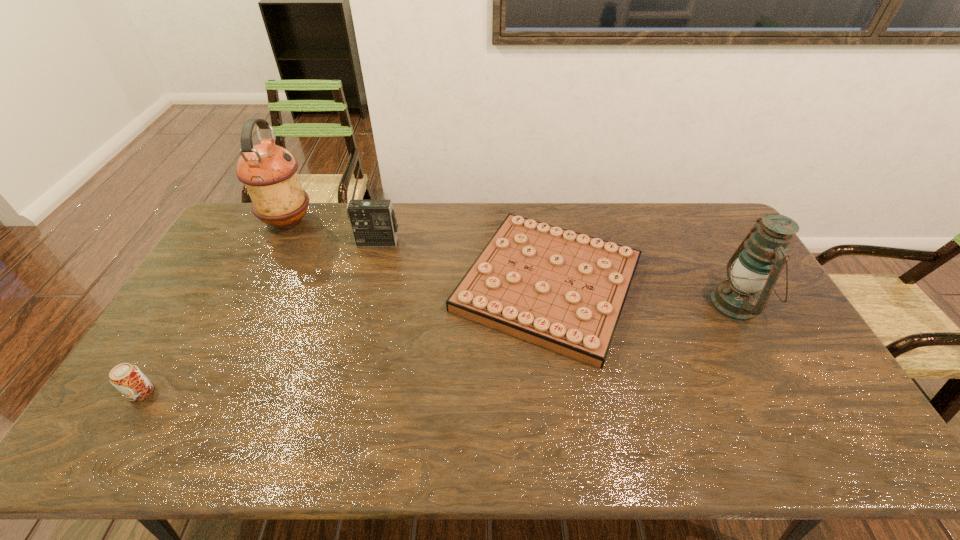
Find the location of a particular element. The width and height of the screenshot is (960, 540). object that is at the far left corner is located at coordinates (269, 172).

Where is `free space at the far edge of the desktop`? Image resolution: width=960 pixels, height=540 pixels. free space at the far edge of the desktop is located at coordinates [399, 235].

You are a GUI agent. You are given a task and a screenshot of the screen. Output one action in this format:
    pyautogui.click(x=<x>, y=<y>)
    Task: Click on the vacant space at the near edge of the desktop
    The width and height of the screenshot is (960, 540).
    Given the screenshot: What is the action you would take?
    pyautogui.click(x=394, y=429)

In the image, there is a desktop. What are the coordinates of `vacant space at the left edge` in the screenshot? It's located at (221, 256).

Where is `vacant area between the fourth object from left to right and the left oil lamp`? vacant area between the fourth object from left to right and the left oil lamp is located at coordinates (418, 253).

At what (x,y) coordinates should I click in order to perform the action: click on vacant point located between the right oil lamp and the second object from right to left. Please return your answer as a coordinate pair (x, y). Looking at the image, I should click on (642, 294).

Locate an element on the screen. This screenshot has height=540, width=960. empty location between the right oil lamp and the second shortest object is located at coordinates (439, 348).

Identify the location of unoccupied position between the beer can and the second object from right to left. (345, 339).

Identify the location of vacant area between the radio receiver and the second object from left to right. This screenshot has width=960, height=540. (333, 232).

You are a GUI agent. You are given a task and a screenshot of the screen. Output one action in this format:
    pyautogui.click(x=<x>, y=<y>)
    Task: Click on the free space between the fourth tallest object and the third object from left to right
    The width and height of the screenshot is (960, 540).
    Given the screenshot: What is the action you would take?
    pyautogui.click(x=260, y=318)